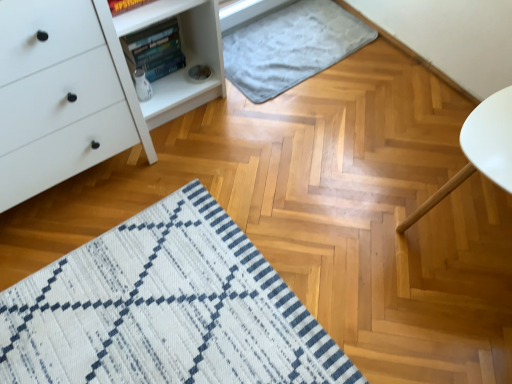
I want to click on free space between white matte chest of drawers at left and white matte table at right, so pos(272,206).